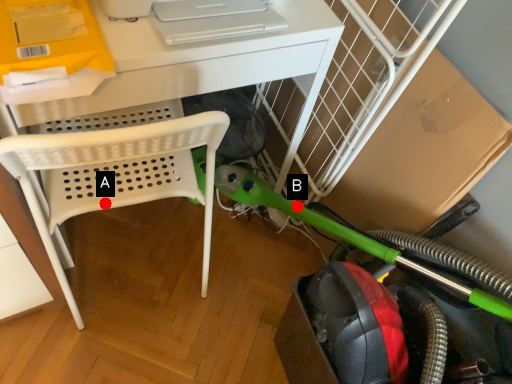
Question: Two points are circled on the image, labeled by A and B beside each circle. Which point is farther to the camera?

Choices:
 (A) A is further
 (B) B is further

Answer: (B)